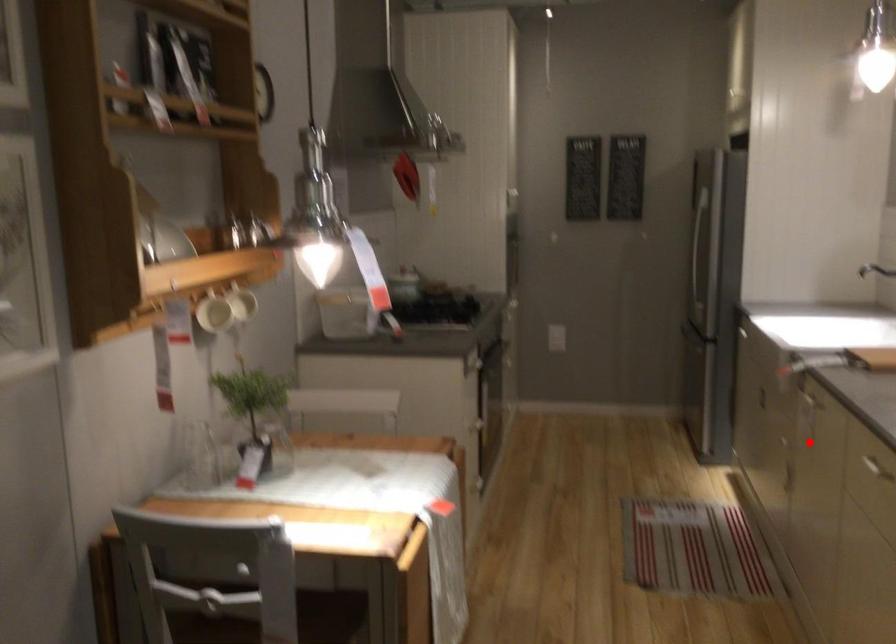
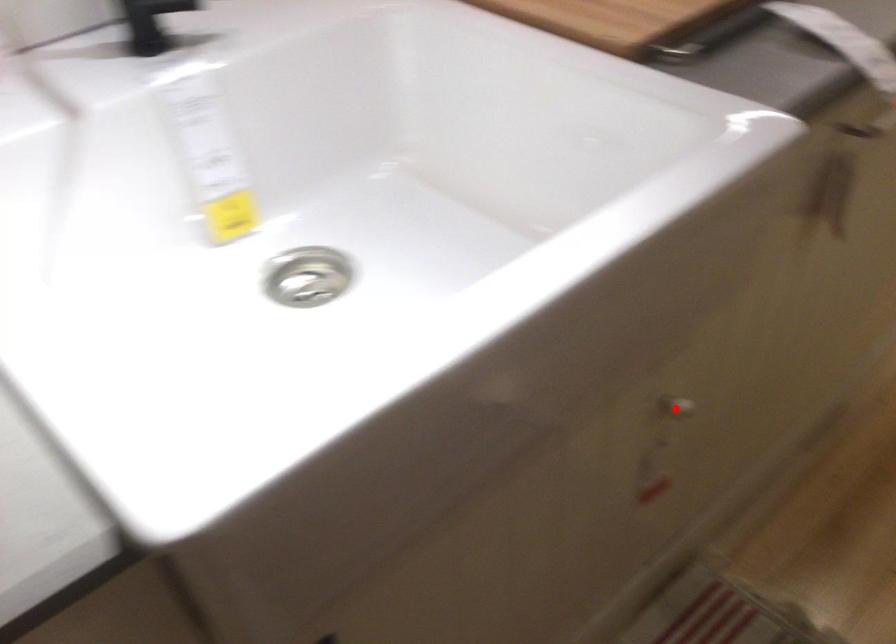
I am providing you with two images of the same scene from different viewpoints. A red point is marked on the first image and another point is marked on the second image. Does the point marked in image1 correspond to the same location as the one in image2?

Yes